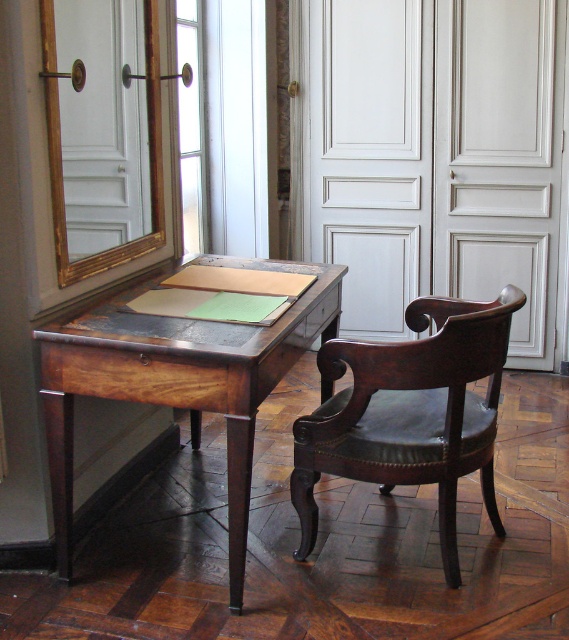
You are an interior designer planning to place a new rug in the room. The rug must be positioned so that it covers both the mahogany wood desk at center and the mahogany leather armchair at center. Is this possible given their spatial relationship?

The mahogany wood desk at center is above the mahogany leather armchair at center, meaning they are vertically aligned. Since the rug lies on the floor, it can cover both objects as they are positioned in the same horizontal plane.